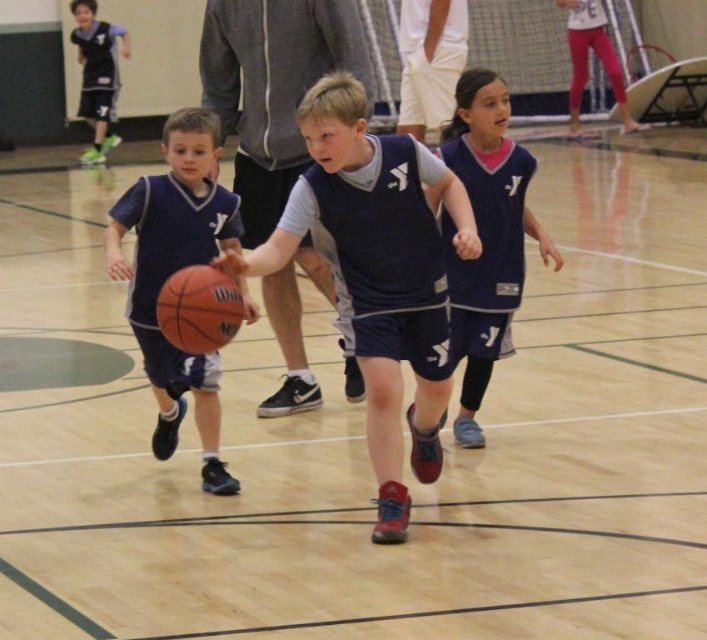
Question: Does matte blue jersey at center lie behind matte black shorts at upper left?

Choices:
 (A) yes
 (B) no

Answer: (B)

Question: In this image, where is rubber basketball at center located relative to gray hoodie at center?

Choices:
 (A) above
 (B) below

Answer: (B)

Question: Which of the following is the farthest from the observer?

Choices:
 (A) (469, 81)
 (B) (448, 3)

Answer: (B)

Question: Which is nearer to the gray hoodie at center?

Choices:
 (A) rubber textured basketball at center
 (B) matte black shorts at upper left
 (C) rubber basketball at center

Answer: (C)

Question: Is matte blue jersey at center smaller than gray hoodie at center?

Choices:
 (A) yes
 (B) no

Answer: (B)

Question: Which object is the farthest from the navy blue jersey at center?

Choices:
 (A) rubber basketball at center
 (B) rubber textured basketball at center

Answer: (B)